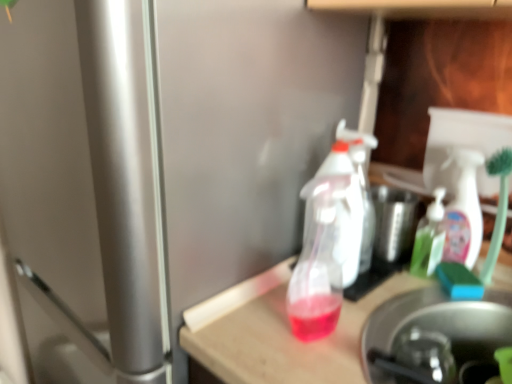
Image resolution: width=512 pixels, height=384 pixels. In order to click on free space that is in between translucent plastic spray bottle at center, which appears as the 2th bottle when viewed from the right, and green translucent soap dispenser at center, the first bottle positioned from the right in this screenshot , I will do `click(377, 296)`.